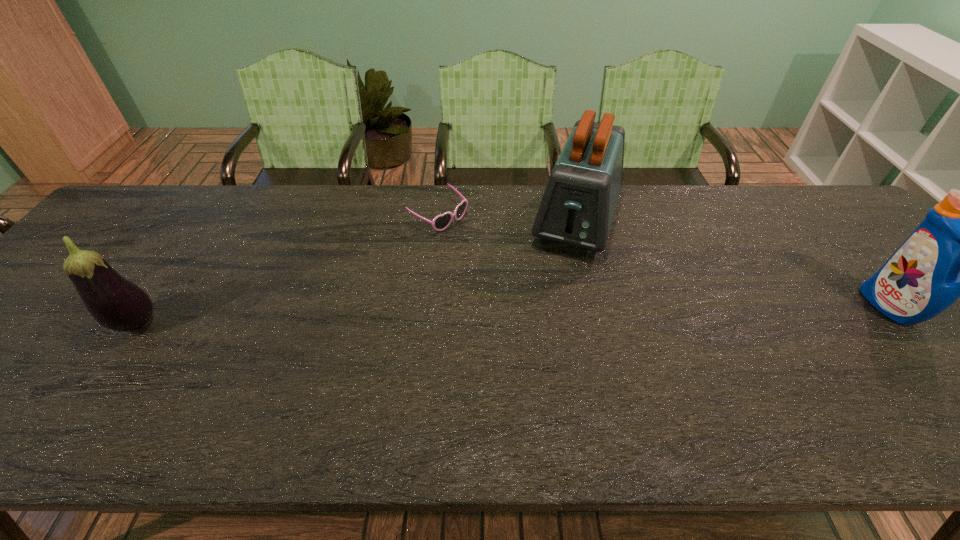
Image resolution: width=960 pixels, height=540 pixels. I want to click on eggplant, so coord(117,304).

The width and height of the screenshot is (960, 540). Identify the location of the rightmost object. (959, 250).

Find the location of a particular element. This screenshot has width=960, height=540. sunglasses is located at coordinates (441, 222).

You are a GUI agent. You are given a task and a screenshot of the screen. Output one action in this format:
    pyautogui.click(x=<x>, y=<y>)
    Task: Click on the shortest object
    
    Given the screenshot: What is the action you would take?
    pyautogui.click(x=441, y=222)

The height and width of the screenshot is (540, 960). I want to click on the third object from left to right, so click(x=577, y=208).

This screenshot has height=540, width=960. Identify the location of vacant space situated on the right of the eggplant. (231, 324).

At what (x,y) coordinates should I click in order to perform the action: click on vacant space situated on the label of the rightmost object. Please return your answer as a coordinate pair (x, y). Image resolution: width=960 pixels, height=540 pixels. Looking at the image, I should click on pyautogui.click(x=749, y=307).

Image resolution: width=960 pixels, height=540 pixels. In order to click on free space located 0.340m on the label of the rightmost object in this screenshot , I will do `click(732, 307)`.

This screenshot has height=540, width=960. Identify the location of vacant region located on the label of the rightmost object. (769, 307).

At what (x,y) coordinates should I click in order to perform the action: click on free space located 0.340m on the front-facing side of the second object from left to right. Please return your answer as a coordinate pair (x, y). Looking at the image, I should click on (553, 289).